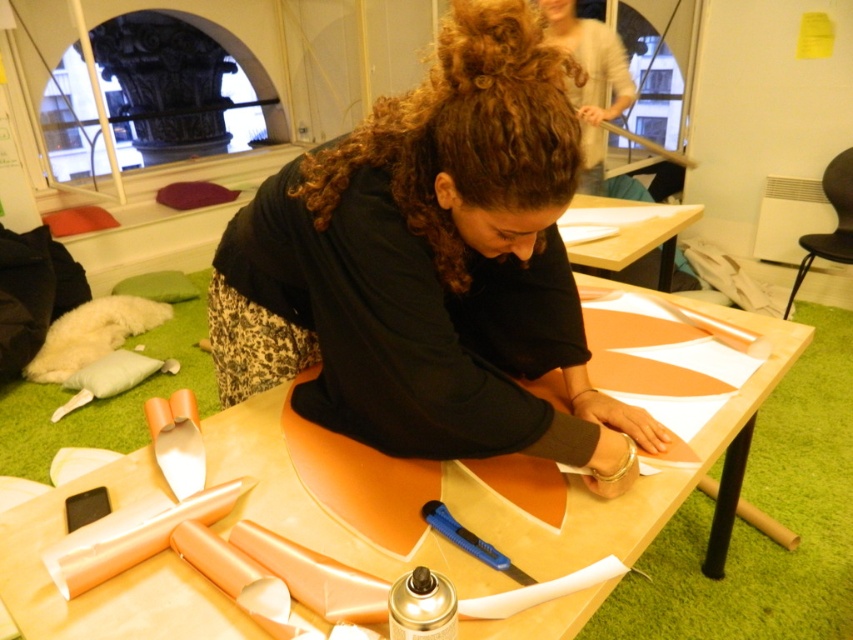
You are standing at the front of the table in the workshop scene. You see two points marked on the orange material. Which point is closer to you, point at coordinate (590, 26) or point at coordinate (589, 259)?

Point at coordinate (589, 259) is closer to you because it is in front of point at coordinate (590, 26).

You are standing in the workshop and want to hand the person at the table a tool from your pocket. The tool is 1.8 meters away from you. Can you reach the matte white shirt at upper center to hand them the tool?

The matte white shirt at upper center is 2.40 meters from viewer. The tool is 1.8 meters away from you, so you cannot reach the matte white shirt at upper center to hand them the tool because it is farther away than the tool.

You are a photographer standing at the camera position. You want to place a small sticker exactly at the point that is 1.01 meters away from your current position. Is the point marked as point (334, 246) in the image the correct location for the sticker?

Yes, the point marked as point (334, 246) is exactly 1.01 meters away from the camera, so placing the sticker there would be correct.